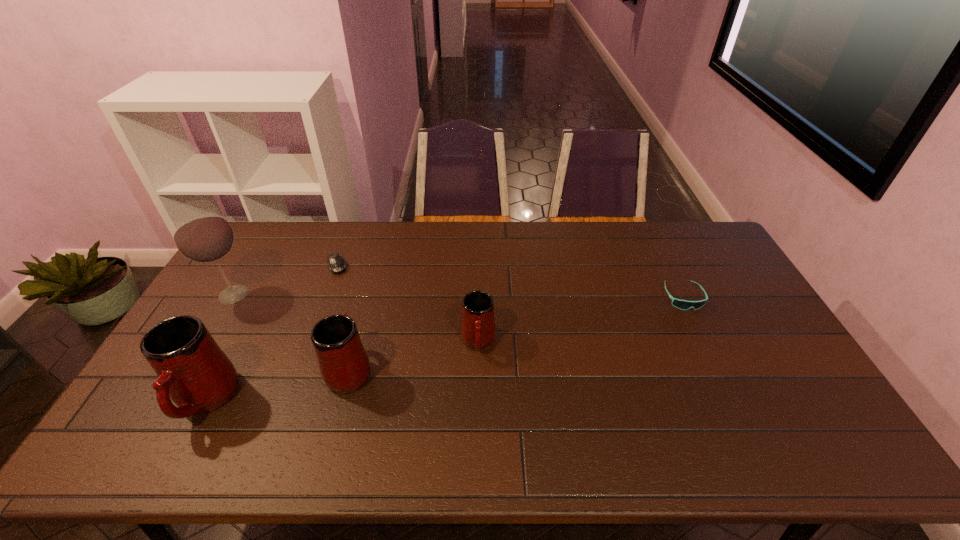
Where is `vacant region located 0.110m on the side of the second mug from left to right with the handle`? This screenshot has height=540, width=960. vacant region located 0.110m on the side of the second mug from left to right with the handle is located at coordinates (364, 317).

Locate an element on the screen. free space located on the side of the second mug from left to right with the handle is located at coordinates (376, 268).

Find the location of a particular element. vacant space located 0.310m on the side of the second mug from left to right with the handle is located at coordinates (374, 274).

Find the location of a particular element. The width and height of the screenshot is (960, 540). vacant region located on the side of the rightmost mug with the handle is located at coordinates (478, 411).

This screenshot has height=540, width=960. What are the coordinates of `free region located 0.090m on the back of the fourth object from right to left` in the screenshot? It's located at (346, 243).

I want to click on free space located on the front-facing side of the sunglasses, so click(x=705, y=342).

The width and height of the screenshot is (960, 540). I want to click on vacant area located 0.240m on the right of the tallest object, so click(331, 295).

Image resolution: width=960 pixels, height=540 pixels. Identify the location of object present at the far edge. (336, 263).

Locate an element on the screen. mug present at the left edge is located at coordinates (192, 370).

At what (x,y) coordinates should I click in order to perform the action: click on alcohol that is at the left edge. Please return your answer as a coordinate pair (x, y). The image size is (960, 540). Looking at the image, I should click on (201, 234).